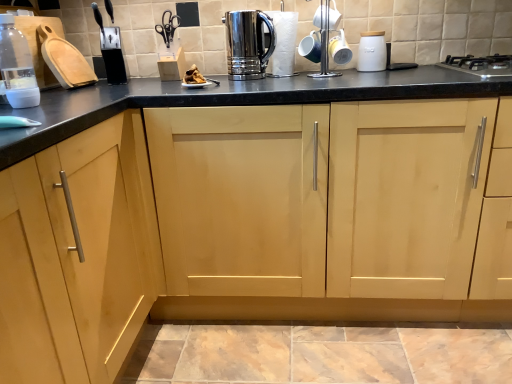
Measure the distance between point (326, 33) and camera.

The distance of point (326, 33) from camera is 1.61 meters.

Locate an element on the screen. white ceramic jar at upper right, positioned as the fourth appliance in left-to-right order is located at coordinates (372, 52).

In order to click on black plastic knife block at upper left, the 4th appliance viewed from the right in this screenshot , I will do `click(111, 50)`.

Where is `white matte bottle at left`? The height and width of the screenshot is (384, 512). white matte bottle at left is located at coordinates (17, 66).

Can you tell me how much natural wood cabinet at center and polished stainless steel kettle at center differ in facing direction?

The facing directions of natural wood cabinet at center and polished stainless steel kettle at center are 4.04 degrees apart.

Looking at this image, is polished stainless steel kettle at center a part of natural wood cabinet at center?

No.

Is the position of natural wood cabinet at center less distant than that of polished stainless steel kettle at center?

Yes, natural wood cabinet at center is closer to the camera.

From a real-world perspective, between natural wood cabinet at center and polished stainless steel kettle at center, who is vertically higher?

polished stainless steel kettle at center.

Is white ceramic jar at upper right, which is counted as the 1th appliance, starting from the right, aimed at metallic mug stand at upper center, the 2th appliance viewed from the right?

No, white ceramic jar at upper right, which is counted as the 1th appliance, starting from the right, is not aimed at metallic mug stand at upper center, the 2th appliance viewed from the right.

In the scene shown: Is white ceramic jar at upper right, which is counted as the 1th appliance, starting from the right, closer to camera compared to metallic mug stand at upper center, the 2th appliance viewed from the right?

That is False.

How many degrees apart are the facing directions of white ceramic jar at upper right, which is counted as the 1th appliance, starting from the right, and metallic mug stand at upper center, the 2th appliance viewed from the right?

The facing directions of white ceramic jar at upper right, which is counted as the 1th appliance, starting from the right, and metallic mug stand at upper center, the 2th appliance viewed from the right, are 0.000521 degrees apart.

From a real-world perspective, is black plastic knife block at upper left, the first appliance from the left, located beneath white ceramic jar at upper right, positioned as the fourth appliance in left-to-right order?

No, from a real-world perspective, black plastic knife block at upper left, the first appliance from the left, is not under white ceramic jar at upper right, positioned as the fourth appliance in left-to-right order.

Is point (94, 2) positioned before point (370, 40)?

No, it is behind (370, 40).

Where is `appliance that is the 3rd one above the white ceramic jar at upper right, which is counted as the 1th appliance, starting from the right (from a real-world perspective)`? This screenshot has height=384, width=512. appliance that is the 3rd one above the white ceramic jar at upper right, which is counted as the 1th appliance, starting from the right (from a real-world perspective) is located at coordinates (111, 50).

Locate an element on the screen. bottle that is on the left side of black stainless steel gas stove at upper right is located at coordinates (17, 66).

From the image's perspective, is black stainless steel gas stove at upper right located beneath white matte bottle at left?

No, from the image's perspective, black stainless steel gas stove at upper right is not below white matte bottle at left.

Is black stainless steel gas stove at upper right wider or thinner than white matte bottle at left?

Considering their sizes, black stainless steel gas stove at upper right looks broader than white matte bottle at left.

Which point is more forward, (496, 66) or (22, 95)?

The point (22, 95) is closer to the camera.

Does point (279, 23) come closer to viewer compared to point (260, 32)?

No, (279, 23) is further to viewer.

Is polished stainless steel coffee pot at upper center, the 2th appliance from the left, far away from polished stainless steel kettle at center?

Actually, polished stainless steel coffee pot at upper center, the 2th appliance from the left, and polished stainless steel kettle at center are a little close together.

Does polished stainless steel coffee pot at upper center, the 2th appliance from the left, appear on the left side of polished stainless steel kettle at center?

No.

Which appliance is the 1st one when counting from the right side of the polished stainless steel kettle at center? Please provide its 2D coordinates.

[(284, 42)]

Could you tell me if white matte bottle at left is facing polished stainless steel kettle at center?

No, white matte bottle at left is not facing towards polished stainless steel kettle at center.

Between white matte bottle at left and polished stainless steel kettle at center, which one has smaller size?

With smaller size is white matte bottle at left.

From the image's perspective, which is below, white matte bottle at left or polished stainless steel kettle at center?

white matte bottle at left, from the image's perspective.

Is natural wood cabinet at center wider than white matte bottle at left?

Indeed, natural wood cabinet at center has a greater width compared to white matte bottle at left.

From the picture: Measure the distance between natural wood cabinet at center and white matte bottle at left.

33.47 inches.

Are natural wood cabinet at center and white matte bottle at left far apart?

Actually, natural wood cabinet at center and white matte bottle at left are a little close together.

Can you confirm if natural wood cabinet at center is smaller than white matte bottle at left?

Actually, natural wood cabinet at center might be larger than white matte bottle at left.

The height and width of the screenshot is (384, 512). What are the coordinates of `cabinetry on the right of polished stainless steel kettle at center` in the screenshot? It's located at (321, 211).

Where is `the 1st appliance above the white ceramic jar at upper right, which is counted as the 1th appliance, starting from the right (from the image's perspective)`? This screenshot has height=384, width=512. the 1st appliance above the white ceramic jar at upper right, which is counted as the 1th appliance, starting from the right (from the image's perspective) is located at coordinates (324, 44).

Considering their positions, is white ceramic jar at upper right, which is counted as the 1th appliance, starting from the right, positioned further to black plastic knife block at upper left, the first appliance from the left, than polished stainless steel coffee pot at upper center, the 3th appliance in the right-to-left sequence?

The object further to black plastic knife block at upper left, the first appliance from the left, is white ceramic jar at upper right, which is counted as the 1th appliance, starting from the right.

From the image, which object appears to be farther from natural wood cabinet at center, white matte bottle at left or black plastic knife block at upper left, the first appliance from the left?

black plastic knife block at upper left, the first appliance from the left, is positioned further to the anchor natural wood cabinet at center.

Estimate the real-world distances between objects in this image. Which object is closer to polished stainless steel kettle at center, black plastic knife block at upper left, the first appliance from the left, or white matte bottle at left?

black plastic knife block at upper left, the first appliance from the left.

Looking at the image, which one is located closer to natural wood cabinet at center, black stainless steel gas stove at upper right or white matte bottle at left?

Among the two, black stainless steel gas stove at upper right is located nearer to natural wood cabinet at center.

Based on the photo, looking at the image, which one is located further to black plastic knife block at upper left, the 4th appliance viewed from the right, white matte bottle at left or white ceramic jar at upper right, which is counted as the 1th appliance, starting from the right?

Based on the image, white ceramic jar at upper right, which is counted as the 1th appliance, starting from the right, appears to be further to black plastic knife block at upper left, the 4th appliance viewed from the right.

Based on their spatial positions, is black plastic knife block at upper left, the first appliance from the left, or black stainless steel gas stove at upper right further from white matte bottle at left?

black stainless steel gas stove at upper right is positioned further to the anchor white matte bottle at left.

From the image, which object appears to be nearer to polished stainless steel kettle at center, white matte bottle at left or black plastic knife block at upper left, the first appliance from the left?

The object closer to polished stainless steel kettle at center is black plastic knife block at upper left, the first appliance from the left.

Estimate the real-world distances between objects in this image. Which object is further from white matte bottle at left, metallic mug stand at upper center, acting as the 3th appliance starting from the left, or polished stainless steel coffee pot at upper center, the 2th appliance from the left?

The object further to white matte bottle at left is metallic mug stand at upper center, acting as the 3th appliance starting from the left.

What are the coordinates of `kitchen appliance between polished stainless steel coffee pot at upper center, the 3th appliance in the right-to-left sequence, and natural wood cabinet at center vertically` in the screenshot? It's located at pos(248,43).

Locate an element on the screen. kitchen appliance situated between white matte bottle at left and metallic mug stand at upper center, the 2th appliance viewed from the right, from left to right is located at coordinates (248, 43).

You are a GUI agent. You are given a task and a screenshot of the screen. Output one action in this format:
    pyautogui.click(x=<x>, y=<y>)
    Task: Click on the appliance situated between black plastic knife block at upper left, the 4th appliance viewed from the right, and natural wood cabinet at center from left to right
    This screenshot has height=384, width=512.
    Given the screenshot: What is the action you would take?
    pyautogui.click(x=284, y=42)

The height and width of the screenshot is (384, 512). In order to click on kitchen appliance between white matte bottle at left and white ceramic jar at upper right, which is counted as the 1th appliance, starting from the right, from left to right in this screenshot , I will do `click(248, 43)`.